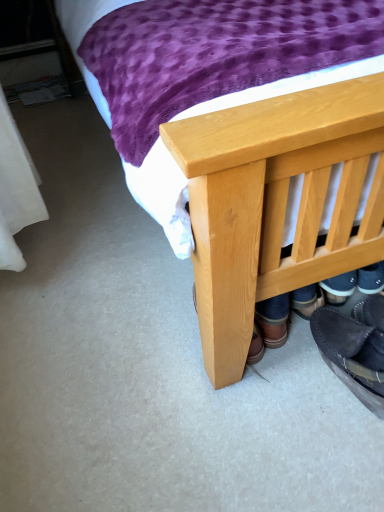
This screenshot has height=512, width=384. In order to click on natural wood bed at center in this screenshot , I will do `click(270, 194)`.

What is the approximate width of natural wood bed at center?

The width of natural wood bed at center is 7.71 feet.

The image size is (384, 512). What do you see at coordinates (270, 194) in the screenshot? I see `natural wood bed at center` at bounding box center [270, 194].

At what (x,y) coordinates should I click in order to perform the action: click on dark brown leather shoe at lower right. Please return your answer as a coordinate pair (x, y). Looking at the image, I should click on click(x=352, y=354).

Describe the element at coordinates (352, 354) in the screenshot. I see `dark brown leather shoe at lower right` at that location.

Where is `natural wood bed at center`? This screenshot has height=512, width=384. natural wood bed at center is located at coordinates (270, 194).

Visually, is natural wood bed at center positioned to the left or to the right of dark brown leather shoe at lower right?

natural wood bed at center is to the right of dark brown leather shoe at lower right.

Which is behind, natural wood bed at center or dark brown leather shoe at lower right?

dark brown leather shoe at lower right is further away from the camera.

Which is behind, point (197, 202) or point (376, 348)?

The point (376, 348) is more distant.

From the image's perspective, is natural wood bed at center located above dark brown leather shoe at lower right?

Yes.

From a real-world perspective, is natural wood bed at center physically located above or below dark brown leather shoe at lower right?

Clearly, from a real-world perspective, natural wood bed at center is above dark brown leather shoe at lower right.

Is natural wood bed at center thinner than dark brown leather shoe at lower right?

No, natural wood bed at center is not thinner than dark brown leather shoe at lower right.

Who is taller, natural wood bed at center or dark brown leather shoe at lower right?

natural wood bed at center is taller.

Considering the relative sizes of natural wood bed at center and dark brown leather shoe at lower right in the image provided, is natural wood bed at center bigger than dark brown leather shoe at lower right?

Indeed, natural wood bed at center has a larger size compared to dark brown leather shoe at lower right.

Is natural wood bed at center positioned beyond the bounds of dark brown leather shoe at lower right?

natural wood bed at center lies outside dark brown leather shoe at lower right's area.

Is natural wood bed at center with dark brown leather shoe at lower right?

No, natural wood bed at center is not touching dark brown leather shoe at lower right.

Is dark brown leather shoe at lower right at the back of natural wood bed at center?

No, natural wood bed at center is not facing away from dark brown leather shoe at lower right.

How different are the orientations of natural wood bed at center and dark brown leather shoe at lower right in degrees?

179 degrees.

Measure the distance from natural wood bed at center to dark brown leather shoe at lower right.

13.34 inches.

At what (x,y) coordinates should I click in order to perform the action: click on footwear below the natural wood bed at center (from the image's perspective). Please return your answer as a coordinate pair (x, y). Looking at the image, I should click on (352, 354).

Does dark brown leather shoe at lower right appear on the left side of natural wood bed at center?

Correct, you'll find dark brown leather shoe at lower right to the left of natural wood bed at center.

Which object is further away from the camera taking this photo, dark brown leather shoe at lower right or natural wood bed at center?

Positioned behind is dark brown leather shoe at lower right.

Which is behind, point (354, 392) or point (337, 122)?

Point (354, 392)

From the image's perspective, between dark brown leather shoe at lower right and natural wood bed at center, which one is located above?

natural wood bed at center, from the image's perspective.

Consider the image. From a real-world perspective, is dark brown leather shoe at lower right under natural wood bed at center?

Yes, from a real-world perspective, dark brown leather shoe at lower right is beneath natural wood bed at center.

Consider the image. Is dark brown leather shoe at lower right wider or thinner than natural wood bed at center?

dark brown leather shoe at lower right is thinner than natural wood bed at center.

Which of these two, dark brown leather shoe at lower right or natural wood bed at center, stands taller?

natural wood bed at center is taller.

In terms of size, does dark brown leather shoe at lower right appear bigger or smaller than natural wood bed at center?

Clearly, dark brown leather shoe at lower right is smaller in size than natural wood bed at center.

From the picture: Is natural wood bed at center completely or partially inside dark brown leather shoe at lower right?

That's incorrect, natural wood bed at center is not inside dark brown leather shoe at lower right.

Are dark brown leather shoe at lower right and natural wood bed at center far apart?

dark brown leather shoe at lower right is actually quite close to natural wood bed at center.

Is dark brown leather shoe at lower right positioned with its back to natural wood bed at center?

Yes.

You are a GUI agent. You are given a task and a screenshot of the screen. Output one action in this format:
    pyautogui.click(x=<x>, y=<y>)
    Task: Click on the footwear on the left of the natural wood bed at center
    
    Given the screenshot: What is the action you would take?
    coord(352,354)

This screenshot has height=512, width=384. What are the coordinates of `bed in front of the dark brown leather shoe at lower right` in the screenshot? It's located at (270, 194).

Where is `footwear behind the natural wood bed at center`? This screenshot has width=384, height=512. footwear behind the natural wood bed at center is located at coordinates (352, 354).